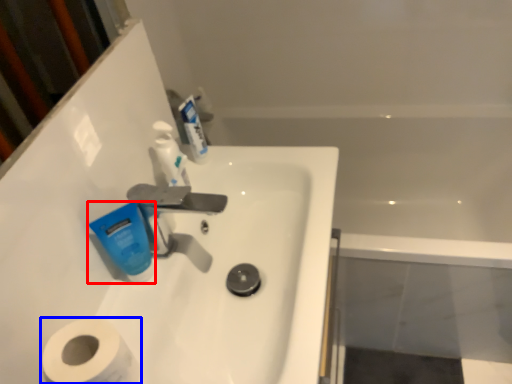
Question: Among these objects, which one is farthest to the camera, mouthwash (highlighted by a red box) or toilet paper (highlighted by a blue box)?

Choices:
 (A) mouthwash
 (B) toilet paper

Answer: (A)